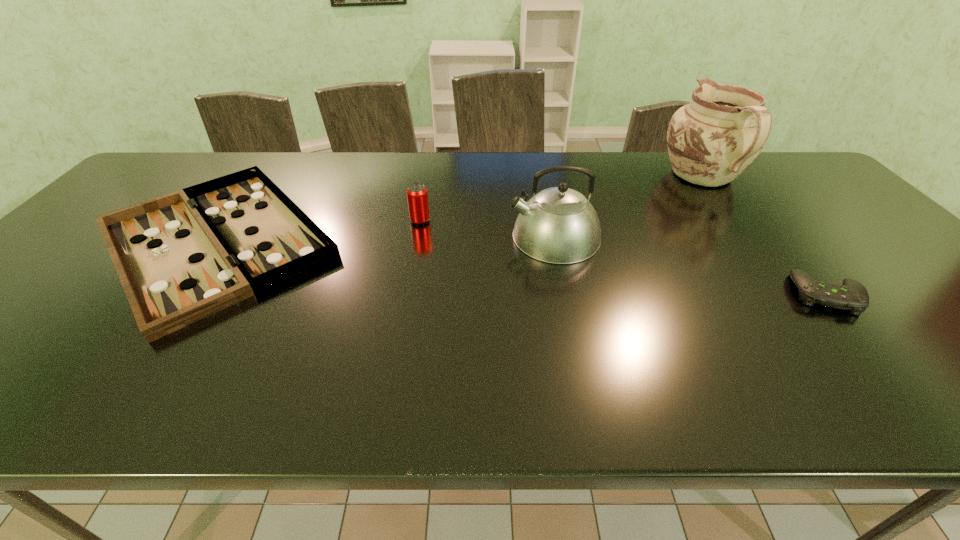
Point out which object is positioned as the nearest to the kettle. Please provide its 2D coordinates. Your answer should be formatted as a tuple, i.e. [(x, y)], where the tuple contains the x and y coordinates of a point satisfying the conditions above.

[(417, 195)]

Where is `vacant region that satisfies the following two spatial constraints: 1. from the spout of the control; 2. on the right side of the third object from left to right`? The height and width of the screenshot is (540, 960). vacant region that satisfies the following two spatial constraints: 1. from the spout of the control; 2. on the right side of the third object from left to right is located at coordinates (566, 294).

You are a GUI agent. You are given a task and a screenshot of the screen. Output one action in this format:
    pyautogui.click(x=<x>, y=<y>)
    Task: Click on the vacant position in the image that satisfies the following two spatial constraints: 1. from the spout of the kettle; 2. on the back side of the control
    Image resolution: width=960 pixels, height=540 pixels.
    Given the screenshot: What is the action you would take?
    pyautogui.click(x=566, y=294)

You are a GUI agent. You are given a task and a screenshot of the screen. Output one action in this format:
    pyautogui.click(x=<x>, y=<y>)
    Task: Click on the free spot that satisfies the following two spatial constraints: 1. from the spout of the kettle; 2. on the right side of the control
    
    Given the screenshot: What is the action you would take?
    pyautogui.click(x=566, y=294)